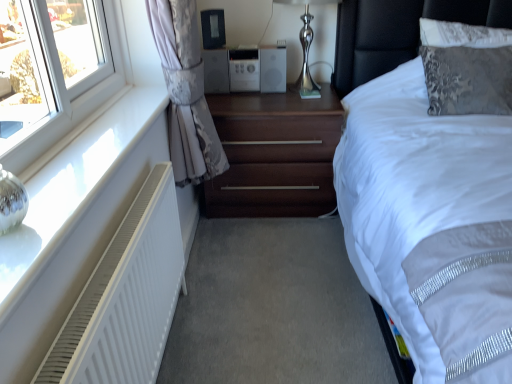
The height and width of the screenshot is (384, 512). Find the location of `empty space that is ontop of dark wood nightstand at center (from a real-world perspective)`. empty space that is ontop of dark wood nightstand at center (from a real-world perspective) is located at coordinates (268, 98).